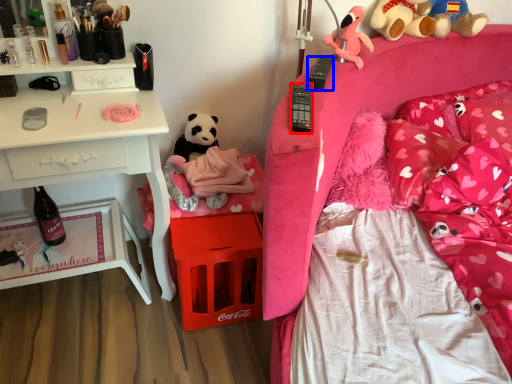
Question: Which object appears closest to the camera in this image, remote control (highlighted by a red box) or remote control (highlighted by a blue box)?

Choices:
 (A) remote control
 (B) remote control

Answer: (A)